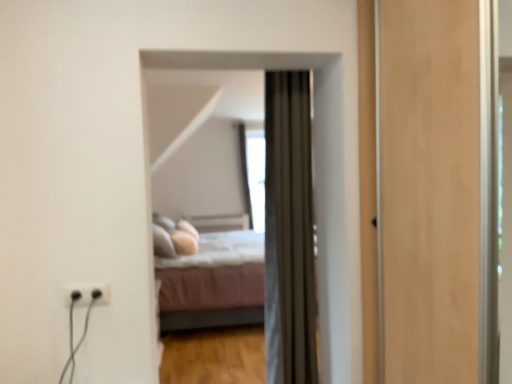
Describe the element at coordinates (289, 231) in the screenshot. This screenshot has height=384, width=512. I see `velvet brown curtain at center` at that location.

Image resolution: width=512 pixels, height=384 pixels. I want to click on transparent glass window at center, so click(256, 177).

What is the approximate width of black plastic outlet at lower left?

black plastic outlet at lower left is 0.59 inches in width.

The image size is (512, 384). In order to click on light pink fabric bed at center in this screenshot , I will do `click(214, 279)`.

Can we say black plastic outlet at lower left lies outside velvet brown curtain at center?

Yes, black plastic outlet at lower left is not within velvet brown curtain at center.

Who is shorter, black plastic outlet at lower left or velvet brown curtain at center?

Standing shorter between the two is black plastic outlet at lower left.

Which object is wider, black plastic outlet at lower left or velvet brown curtain at center?

With larger width is velvet brown curtain at center.

Looking at this image, from a real-world perspective, is light pink fabric bed at center positioned over velvet brown curtain at center based on gravity?

No, from a real-world perspective, light pink fabric bed at center is not over velvet brown curtain at center

Based on the photo, considering the sizes of objects light pink fabric bed at center and velvet brown curtain at center in the image provided, who is bigger, light pink fabric bed at center or velvet brown curtain at center?

light pink fabric bed at center.

Is light pink fabric bed at center thinner than velvet brown curtain at center?

In fact, light pink fabric bed at center might be wider than velvet brown curtain at center.

How many degrees apart are the facing directions of light pink fabric bed at center and velvet brown curtain at center?

They differ by 90.6 degrees in their facing directions.

Is velvet brown curtain at center taller or shorter than black plastic outlet at lower left?

Clearly, velvet brown curtain at center is taller compared to black plastic outlet at lower left.

Is velvet brown curtain at center facing away from black plastic outlet at lower left?

No, velvet brown curtain at center is not facing the opposite direction of black plastic outlet at lower left.

Does point (280, 262) appear closer or farther from the camera than point (98, 290)?

Clearly, point (280, 262) is more distant from the camera than point (98, 290).

Considering the positions of objects velvet brown curtain at center and black plastic outlet at lower left in the image provided, who is more to the right, velvet brown curtain at center or black plastic outlet at lower left?

velvet brown curtain at center.

Do you think black plastic outlet at lower left is within light pink fabric bed at center, or outside of it?

The correct answer is: outside.

Considering the sizes of objects black plastic outlet at lower left and light pink fabric bed at center in the image provided, who is taller, black plastic outlet at lower left or light pink fabric bed at center?

Standing taller between the two is light pink fabric bed at center.

Based on the photo, can you confirm if black plastic outlet at lower left is smaller than light pink fabric bed at center?

Yes, black plastic outlet at lower left is smaller than light pink fabric bed at center.

Would you say black plastic outlet at lower left is a long distance from light pink fabric bed at center?

Yes, black plastic outlet at lower left is far from light pink fabric bed at center.

Does velvet brown curtain at center have a greater width compared to light pink fabric bed at center?

No.

Is velvet brown curtain at center oriented towards light pink fabric bed at center?

Yes, velvet brown curtain at center is facing light pink fabric bed at center.

From the image's perspective, relative to light pink fabric bed at center, is velvet brown curtain at center above or below?

velvet brown curtain at center is situated higher than light pink fabric bed at center in the image.

This screenshot has height=384, width=512. What are the coordinates of `window above the velvet brown curtain at center (from the image's perspective)` in the screenshot? It's located at (256, 177).

From the image's perspective, does transparent glass window at center appear higher than velvet brown curtain at center?

Yes.

Considering the positions of point (258, 203) and point (306, 277), is point (258, 203) closer or farther from the camera than point (306, 277)?

Point (258, 203) is positioned farther from the camera compared to point (306, 277).

Which of these two, transparent glass window at center or velvet brown curtain at center, is smaller?

With smaller size is velvet brown curtain at center.

Is transparent glass window at center inside velvet brown curtain at center?

Definitely not — transparent glass window at center is not inside velvet brown curtain at center.

Is velvet brown curtain at center facing away from transparent glass window at center?

velvet brown curtain at center does not have its back to transparent glass window at center.

Does velvet brown curtain at center come behind transparent glass window at center?

No, it is in front of transparent glass window at center.

How different are the orientations of velvet brown curtain at center and transparent glass window at center in degrees?

176 degrees.

Where is `electric outlet that is under the velvet brown curtain at center (from a real-world perspective)`? This screenshot has height=384, width=512. electric outlet that is under the velvet brown curtain at center (from a real-world perspective) is located at coordinates (88, 293).

Identify the location of curtain that appears in front of the light pink fabric bed at center. (289, 231).

Looking at the image, which one is located further to light pink fabric bed at center, black plastic outlet at lower left or transparent glass window at center?

black plastic outlet at lower left lies further to light pink fabric bed at center than the other object.

Looking at the image, which one is located further to velvet brown curtain at center, light pink fabric bed at center or black plastic outlet at lower left?

Based on the image, light pink fabric bed at center appears to be further to velvet brown curtain at center.

Looking at the image, which one is located closer to black plastic outlet at lower left, light pink fabric bed at center or velvet brown curtain at center?

velvet brown curtain at center lies closer to black plastic outlet at lower left than the other object.

Which object lies further to the anchor point transparent glass window at center, velvet brown curtain at center or light pink fabric bed at center?

velvet brown curtain at center.

Considering their positions, is black plastic outlet at lower left positioned closer to transparent glass window at center than light pink fabric bed at center?

light pink fabric bed at center lies closer to transparent glass window at center than the other object.

From the image, which object appears to be farther from black plastic outlet at lower left, transparent glass window at center or velvet brown curtain at center?

transparent glass window at center lies further to black plastic outlet at lower left than the other object.

Considering their positions, is light pink fabric bed at center positioned closer to transparent glass window at center than black plastic outlet at lower left?

light pink fabric bed at center.

From the picture: Looking at the image, which one is located further to velvet brown curtain at center, black plastic outlet at lower left or light pink fabric bed at center?

Based on the image, light pink fabric bed at center appears to be further to velvet brown curtain at center.

You are a GUI agent. You are given a task and a screenshot of the screen. Output one action in this format:
    pyautogui.click(x=<x>, y=<y>)
    Task: Click on the bed positioned between black plastic outlet at lower left and transparent glass window at center from near to far
    The height and width of the screenshot is (384, 512).
    Given the screenshot: What is the action you would take?
    pyautogui.click(x=214, y=279)

Where is `curtain between black plastic outlet at lower left and transparent glass window at center in the front-back direction`? The width and height of the screenshot is (512, 384). curtain between black plastic outlet at lower left and transparent glass window at center in the front-back direction is located at coordinates (289, 231).

Identify the location of bed between velvet brown curtain at center and transparent glass window at center in the front-back direction. The image size is (512, 384). (214, 279).

Image resolution: width=512 pixels, height=384 pixels. Identify the location of curtain positioned between black plastic outlet at lower left and light pink fabric bed at center from near to far. (289, 231).